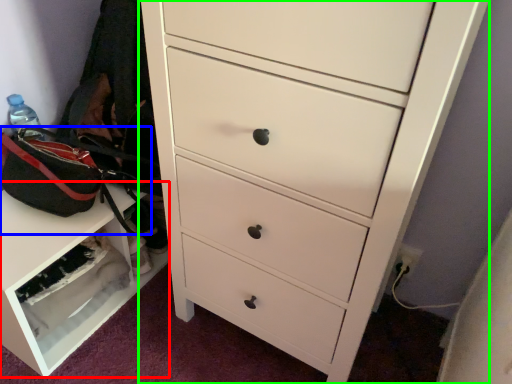
Question: Which object is the farthest from cabinetry (highlighted by a red box)? Choose among these: messenger bag (highlighted by a blue box) or chest of drawers (highlighted by a green box).

Choices:
 (A) messenger bag
 (B) chest of drawers

Answer: (B)